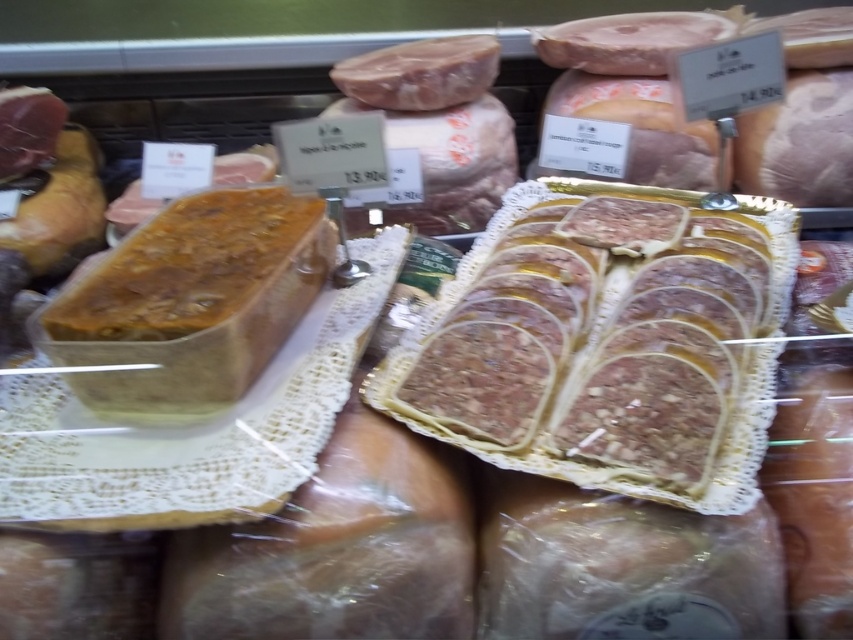
Consider the image. You are a customer at the deli and want to know which item is taller between the sliced brown meat at center and the brown crumbly loaf at center. Can you tell me?

The sliced brown meat at center is taller than the brown crumbly loaf at center.

You are a customer looking at the display case in the deli. You want to find the sliced brown meat at center. Where would you look within the case?

The sliced brown meat at center is located at the 2D coordinates point (607, 342) within the display case.

You are a customer at the deli counter. You see the sliced brown meat at center and the brown crumbly loaf at center. Which one is closer to you?

The sliced brown meat at center is closer to you because it is positioned under the brown crumbly loaf at center, meaning it is in front of it from your perspective.